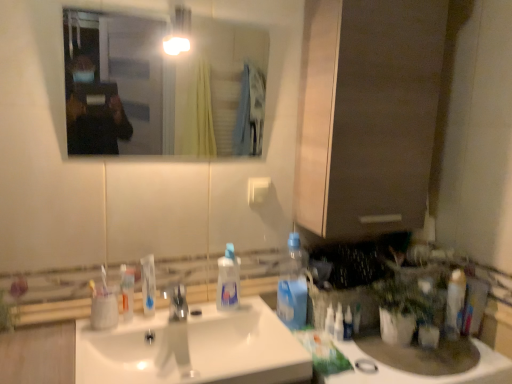
Find the location of a particular element. Image resolution: width=512 pixels, height=384 pixels. vacant area in front of white glossy toothpaste at center is located at coordinates (131, 334).